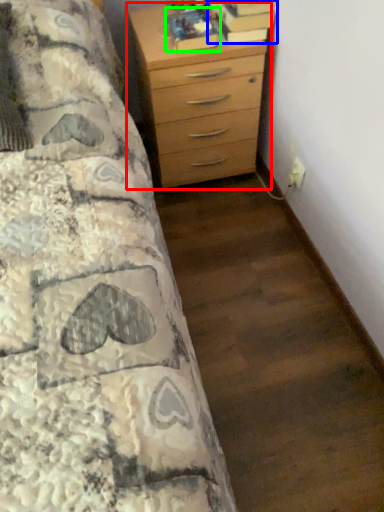
Question: Based on their relative distances, which object is nearer to chest of drawers (highlighted by a red box)? Choose from book (highlighted by a blue box) and book (highlighted by a green box).

Choices:
 (A) book
 (B) book

Answer: (B)